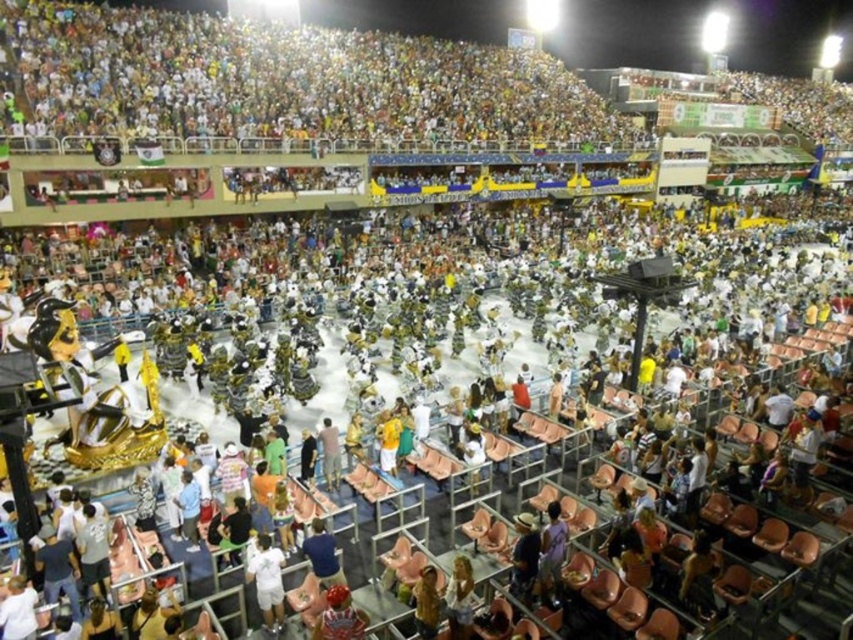
Question: Does white matte shirt at lower center have a larger size compared to light brown leather jacket at center?

Choices:
 (A) no
 (B) yes

Answer: (B)

Question: Among these objects, which one is farthest from the camera?

Choices:
 (A) white matte shirt at lower center
 (B) light brown leather jacket at center

Answer: (B)

Question: Does white matte shirt at lower center appear on the left side of light brown leather jacket at center?

Choices:
 (A) yes
 (B) no

Answer: (A)

Question: Is white matte shirt at lower center wider than light brown leather jacket at center?

Choices:
 (A) no
 (B) yes

Answer: (B)